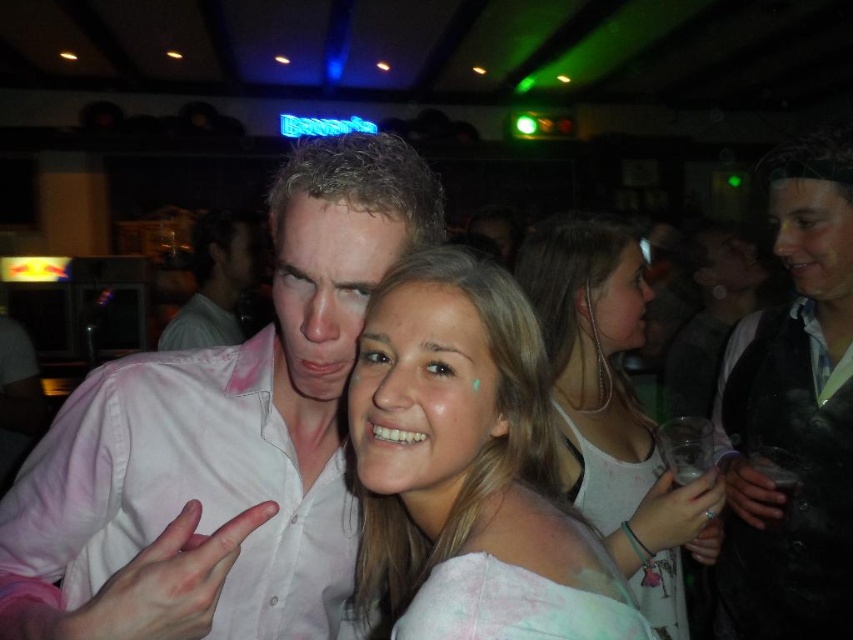
Who is more distant from viewer, (291, 257) or (256, 236)?

The point (256, 236) is behind.

Does point (219, 454) come closer to viewer compared to point (210, 241)?

Yes, point (219, 454) is closer to viewer.

Is point (257, 608) farther from camera compared to point (228, 285)?

No, (257, 608) is in front of (228, 285).

Find the location of a particular element. pink cotton shirt at center is located at coordinates [x=222, y=440].

Which is more to the right, pink cotton shirt at center or white tank top at center?

white tank top at center

Is point (135, 624) less distant than point (567, 460)?

Yes, point (135, 624) is in front of point (567, 460).

I want to click on pink cotton shirt at center, so click(x=222, y=440).

Does light brown hair at center appear under white tank top at center?

Yes.

Is point (579, 637) behind point (628, 493)?

No, it is in front of (628, 493).

Which is in front, point (436, 326) or point (595, 518)?

Point (436, 326) is in front.

Where is `light brown hair at center`? The height and width of the screenshot is (640, 853). light brown hair at center is located at coordinates (463, 452).